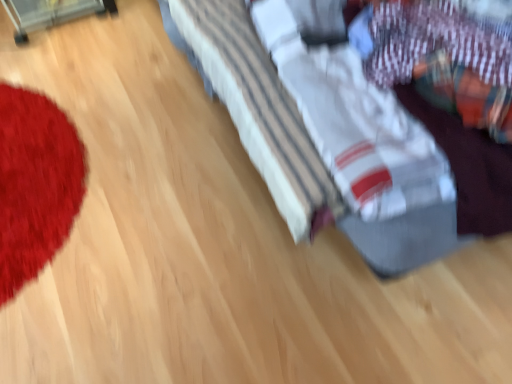
Locate an element on the screen. The width and height of the screenshot is (512, 384). fluffy red rug at left is located at coordinates (35, 184).

The width and height of the screenshot is (512, 384). Describe the element at coordinates (35, 184) in the screenshot. I see `fluffy red rug at left` at that location.

This screenshot has width=512, height=384. Identify the location of fluffy red rug at left. click(x=35, y=184).